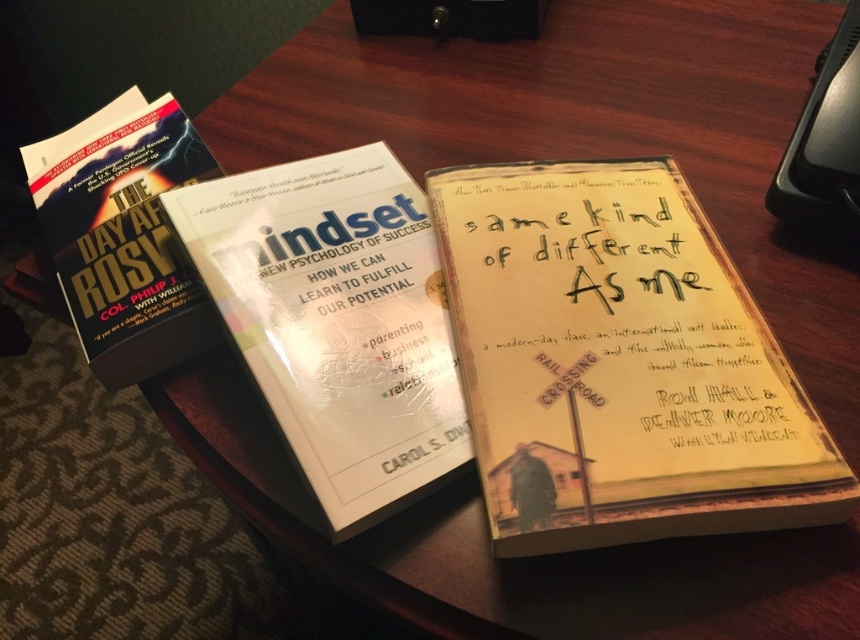
You are standing in front of the wooden surface with the books. There are two points marked on the surface. One is at coordinates point (x=505, y=433) and the other is at point (x=263, y=227). Which point is closer to you?

Point (x=505, y=433) is closer to the viewer than point (x=263, y=227).

You are organizing books on a desk and need to place a new book between the leftmost book and the white glossy book at center. The new book is 3 inches thick. Will there be enough space between them?

The distance between the leftmost book and the white glossy book at center is 17.25 inches. Since the new book is only 3 inches thick, there is sufficient space to place it between them.

You are taking a photo of the books on the wooden surface. You want to focus on the point at point (585, 451) and point (140, 291). Which point should you focus on first to ensure both are in focus?

You should focus on point (585, 451) first because it is closer to the camera than point (140, 291), allowing the depth of field to cover both points effectively.